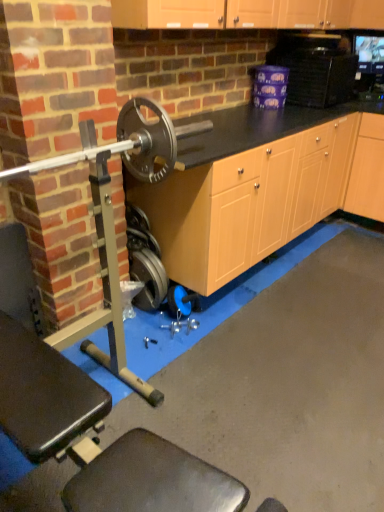
Question: Is polished silver barbell at left bigger or smaller than black plastic microwave at upper right?

Choices:
 (A) small
 (B) big

Answer: (B)

Question: Is polished silver barbell at left inside or outside of black plastic microwave at upper right?

Choices:
 (A) outside
 (B) inside

Answer: (A)

Question: Based on their relative distances, which object is farther from the black plastic microwave at upper right?

Choices:
 (A) metallic silver weight at lower center
 (B) polished silver barbell at left
 (C) light wood cabinet at right

Answer: (A)

Question: Which object is the farthest from the polished silver barbell at left?

Choices:
 (A) light wood cabinet at right
 (B) metallic silver weight at lower center
 (C) black plastic microwave at upper right

Answer: (A)